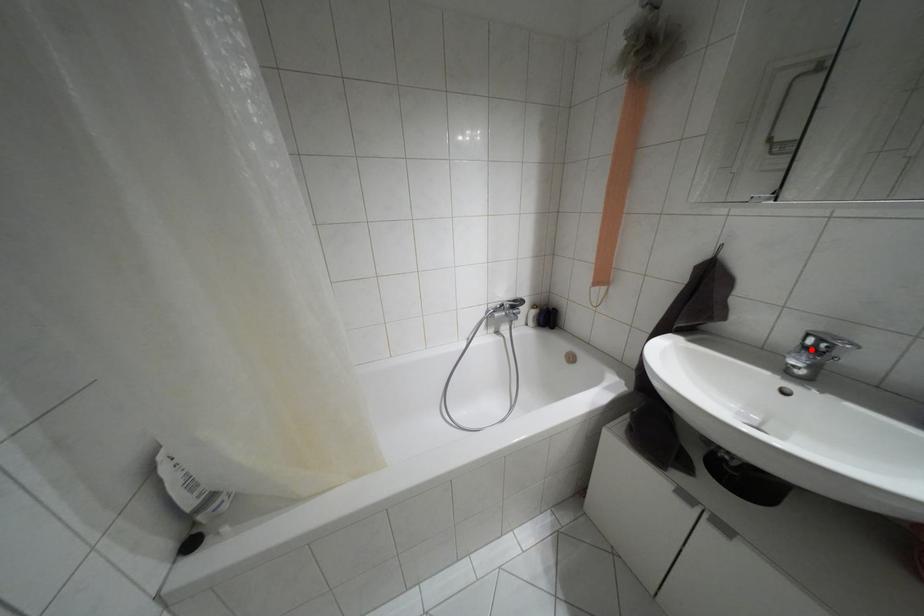
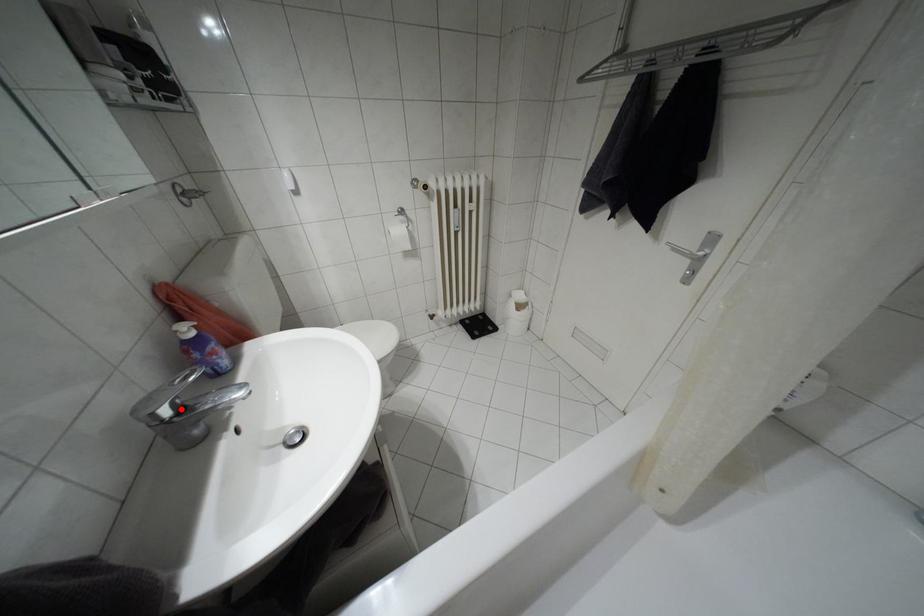
I am providing you with two images of the same scene from different viewpoints. A red point is marked on the first image and another point is marked on the second image. Is the marked point in image1 the same physical position as the marked point in image2?

Yes